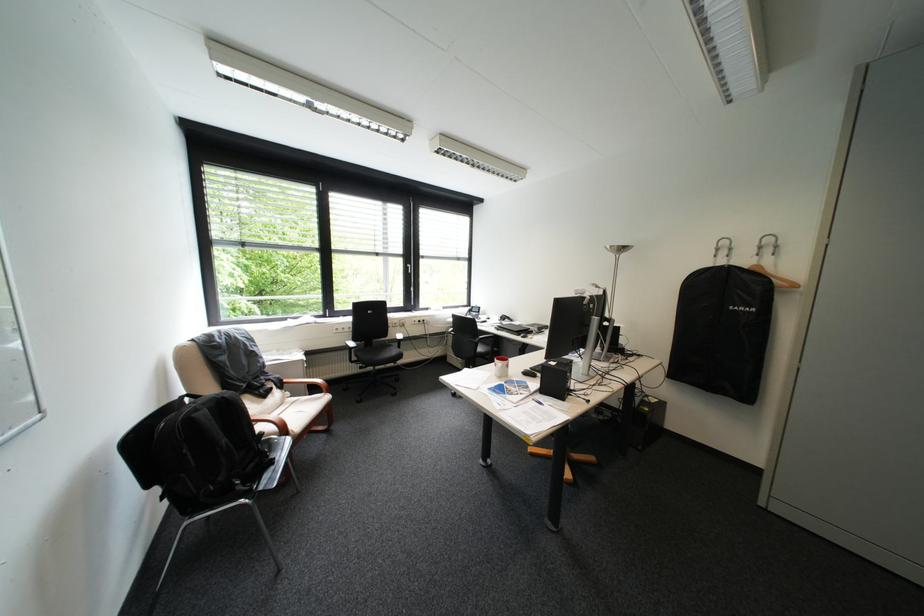
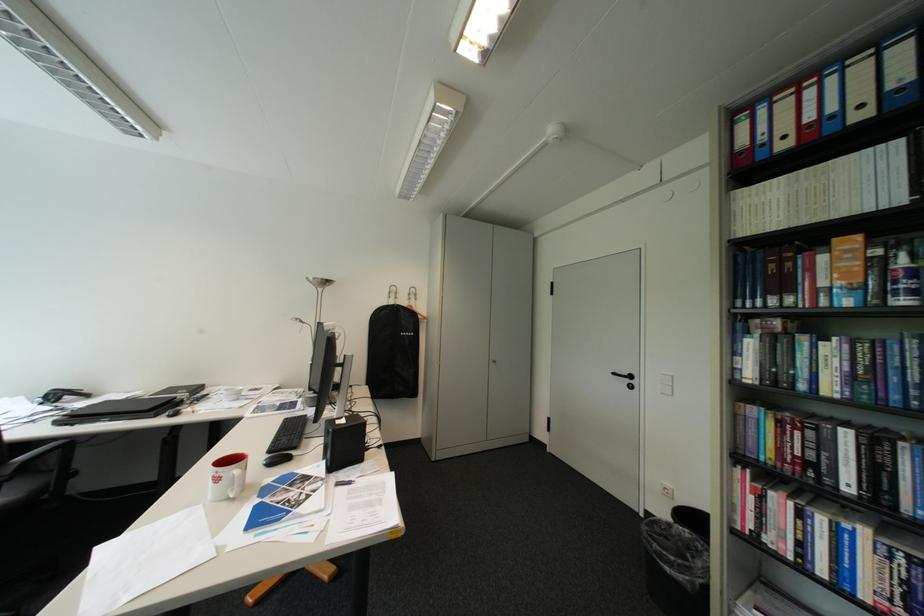
The point at (x=507, y=365) is marked in the first image. Where is the corresponding point in the second image?

(228, 480)